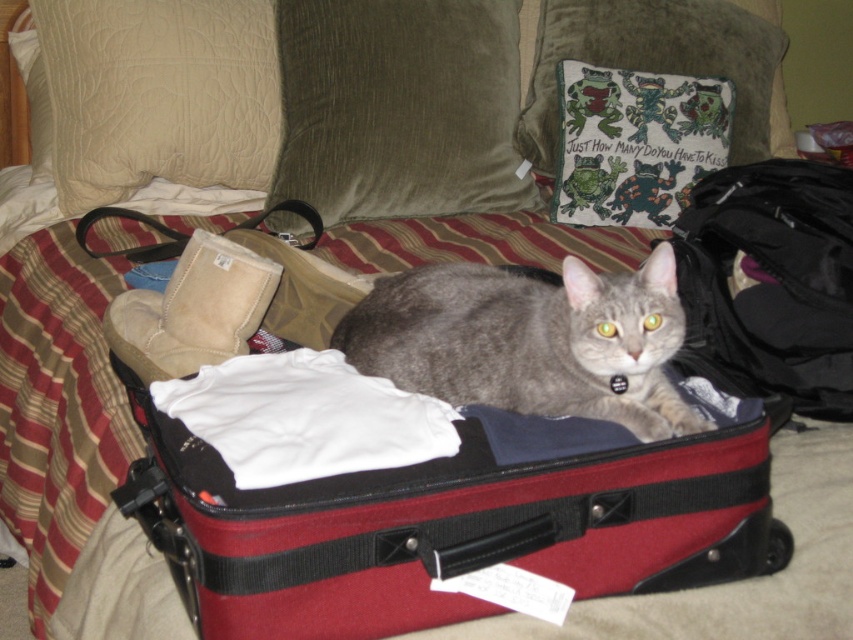
Question: Which object is farther from the camera taking this photo?

Choices:
 (A) beige quilted pillow at upper left
 (B) velvety olive green pillow at upper center
 (C) matte black suitcase at center
 (D) soft black fabric at center

Answer: (B)

Question: Is soft black fabric at center behind green fabric pillow with frogs at upper center?

Choices:
 (A) no
 (B) yes

Answer: (A)

Question: Estimate the real-world distances between objects in this image. Which object is farther from the beige quilted pillow at upper left?

Choices:
 (A) white fabric at center
 (B) matte black suitcase at center
 (C) green fabric pillow with frogs at upper center
 (D) gray fur cat at center

Answer: (A)

Question: Based on their relative distances, which object is nearer to the velvety olive green pillow at upper center?

Choices:
 (A) soft black fabric at center
 (B) beige quilted pillow at upper left
 (C) matte black suitcase at center

Answer: (B)

Question: Observing the image, what is the correct spatial positioning of beige quilted pillow at upper left in reference to soft black fabric at center?

Choices:
 (A) right
 (B) left

Answer: (B)

Question: Is beige quilted pillow at upper left smaller than green fabric pillow with frogs at upper center?

Choices:
 (A) no
 (B) yes

Answer: (B)